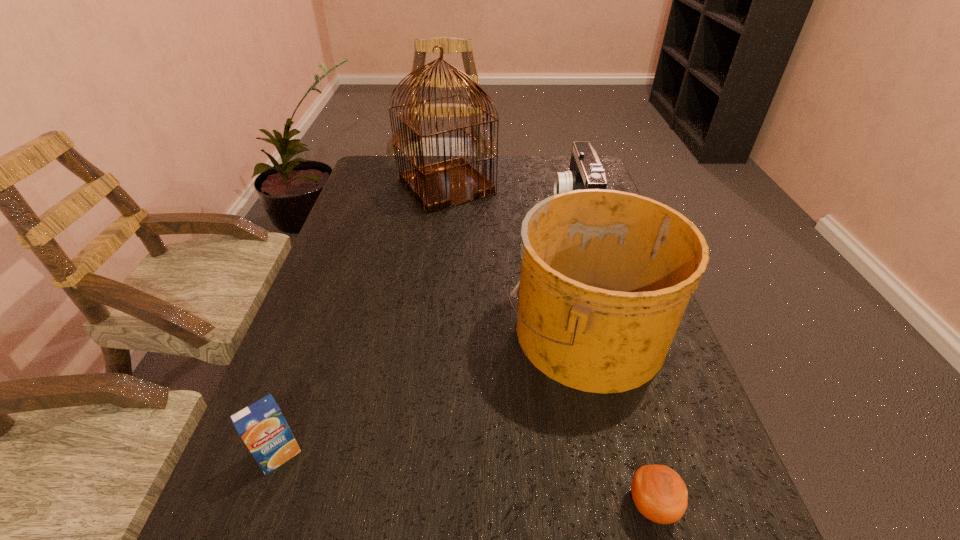
Locate an element on the screen. This screenshot has width=960, height=540. blank space located on the back of the bucket is located at coordinates (556, 207).

The image size is (960, 540). What are the coordinates of `vacant space located on the lens of the third shortest object` in the screenshot? It's located at (443, 208).

Image resolution: width=960 pixels, height=540 pixels. Find the location of `vacant area situated on the lens of the third shortest object`. vacant area situated on the lens of the third shortest object is located at coordinates (456, 208).

Image resolution: width=960 pixels, height=540 pixels. Find the location of `vacant space located 0.130m on the lens of the third shortest object`. vacant space located 0.130m on the lens of the third shortest object is located at coordinates coord(509,208).

Where is `vacant region located 0.390m on the back of the second nearest object`? vacant region located 0.390m on the back of the second nearest object is located at coordinates (341, 281).

In order to click on free spot located 0.050m on the right of the orange in this screenshot , I will do `click(711, 505)`.

This screenshot has width=960, height=540. Identify the location of birdcage that is at the far edge. (445, 184).

Locate an element on the screen. camcorder located at the far edge is located at coordinates (585, 172).

Locate an element on the screen. birdcage that is at the left edge is located at coordinates (445, 184).

Find the location of a particular element. Image resolution: width=960 pixels, height=540 pixels. orange_juice that is at the left edge is located at coordinates (261, 425).